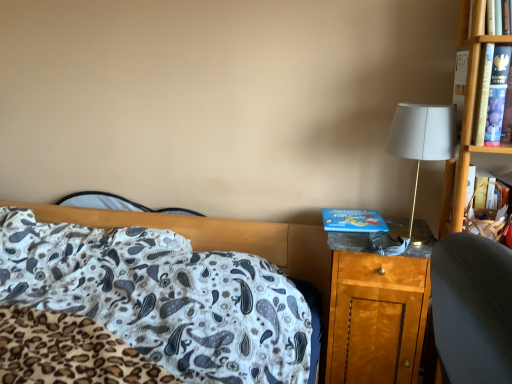
Question: From a real-world perspective, relative to wooden nightstand at right, is white paisley fabric at center vertically above or below?

Choices:
 (A) below
 (B) above

Answer: (B)

Question: Considering the positions of white paisley fabric at center and wooden nightstand at right in the image, is white paisley fabric at center bigger or smaller than wooden nightstand at right?

Choices:
 (A) big
 (B) small

Answer: (A)

Question: Estimate the real-world distances between objects in this image. Which object is closer to the blue cardboard book at right?

Choices:
 (A) white fabric lampshade at right
 (B) white paisley fabric at center
 (C) wooden nightstand at right

Answer: (C)

Question: Which is nearer to the white fabric lampshade at right?

Choices:
 (A) blue cardboard book at right
 (B) wooden nightstand at right
 (C) white paisley fabric at center

Answer: (A)